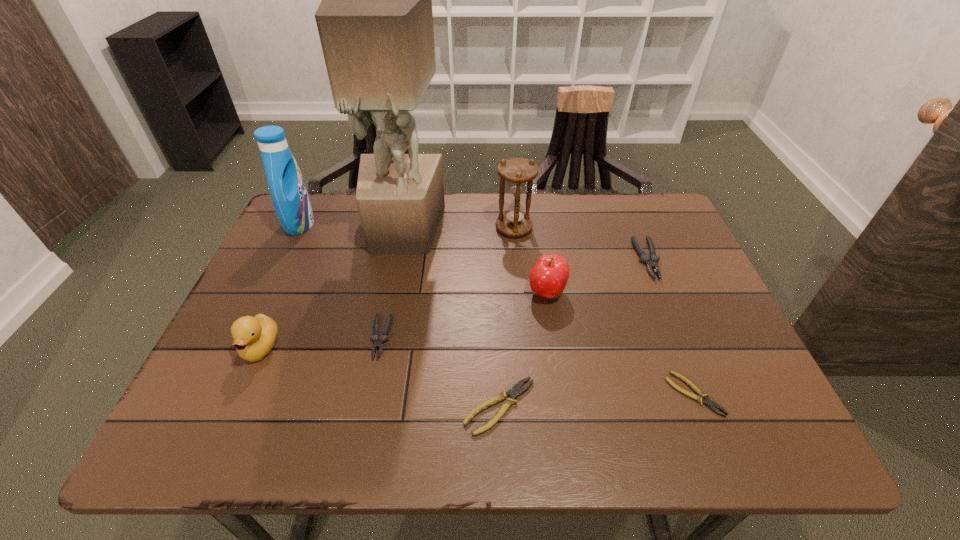
Where is `free spot located 0.180m at the gripping part of the leftmost pliers`? free spot located 0.180m at the gripping part of the leftmost pliers is located at coordinates (359, 442).

I want to click on vacant space located on the left of the eighth tallest object, so click(367, 407).

Where is `free region located on the left of the shortest pliers`? The width and height of the screenshot is (960, 540). free region located on the left of the shortest pliers is located at coordinates (490, 394).

The height and width of the screenshot is (540, 960). Find the location of `sculpture that is at the far edge`. sculpture that is at the far edge is located at coordinates (375, 22).

The height and width of the screenshot is (540, 960). I want to click on detergent that is at the far edge, so click(290, 198).

Locate an element on the screen. This screenshot has height=540, width=960. hourglass that is at the far edge is located at coordinates (519, 173).

The image size is (960, 540). Find the location of `pliers at the far edge`. pliers at the far edge is located at coordinates pyautogui.click(x=651, y=262).

Locate an element on the screen. detergent situated at the left edge is located at coordinates (290, 198).

This screenshot has height=540, width=960. Find the location of `duckling positioned at the left edge`. duckling positioned at the left edge is located at coordinates coord(254,337).

Identify the location of object located at the far left corner. (290, 198).